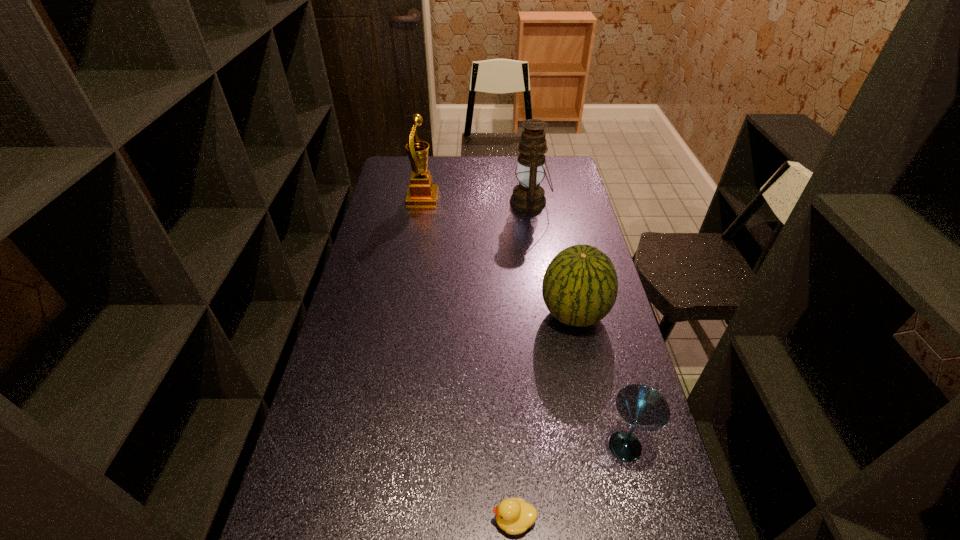
Where is `award`? The image size is (960, 540). award is located at coordinates (421, 191).

You are a GUI agent. You are given a task and a screenshot of the screen. Output one action in this format:
    pyautogui.click(x=<x>, y=<y>)
    Task: Click on the oil lamp
    
    Given the screenshot: What is the action you would take?
    pyautogui.click(x=528, y=196)

Where is `the third farthest object`? the third farthest object is located at coordinates (580, 285).

At what (x,y) coordinates should I click in order to perform the action: click on watermelon. Please return your answer as a coordinate pair (x, y). The width and height of the screenshot is (960, 540). Looking at the image, I should click on (580, 285).

Identify the location of the fourth farthest object. The image size is (960, 540). (642, 407).

I want to click on the fourth tallest object, so click(x=642, y=407).

Locate an element on the screen. the second object from left to right is located at coordinates (514, 516).

Where is `the shortest object`? the shortest object is located at coordinates (514, 516).

Identify the location of vacant region located on the front-facing side of the leftmost object. Image resolution: width=960 pixels, height=540 pixels. coord(506,198).

Image resolution: width=960 pixels, height=540 pixels. Identify the location of vacant region located 0.200m on the front of the oil lamp. (537, 248).